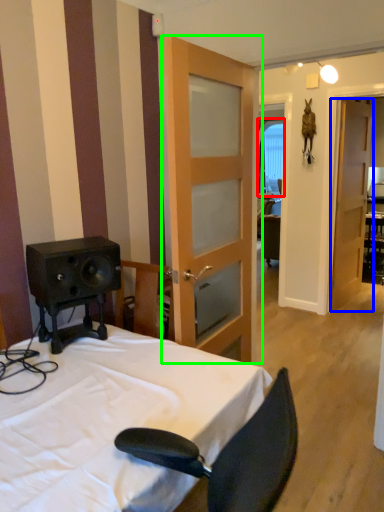
Question: Which object is positioned farthest from window (highlighted by a red box)? Select from door (highlighted by a blue box) and door (highlighted by a green box).

Choices:
 (A) door
 (B) door

Answer: (B)